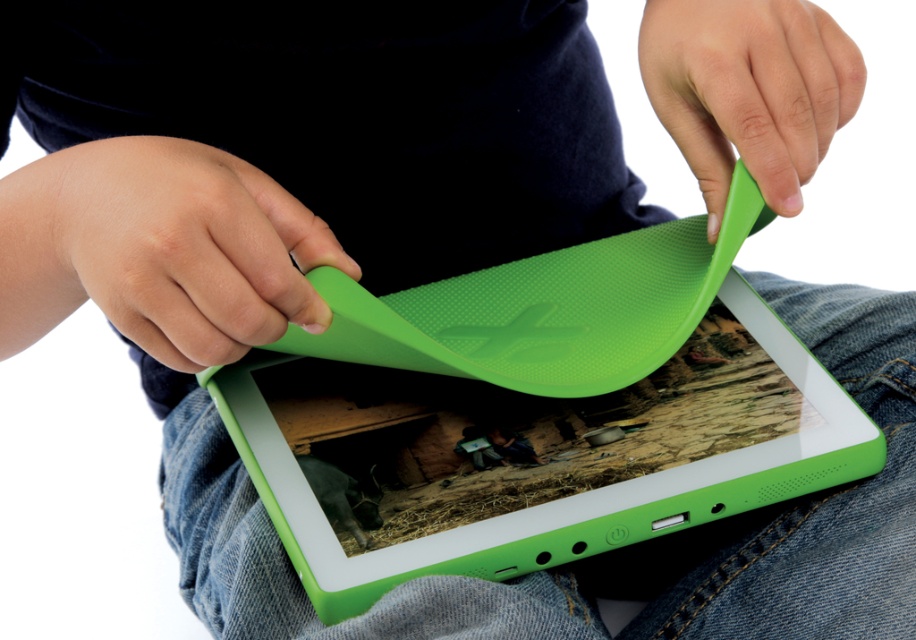
You are a delivery person who needs to place a green rubber tablet at center and a green matte tablet cover at upper left into a box that can only accommodate items within 6 inches of each other. Can you fit both items into the box without exceeding the distance limit?

The distance between the green rubber tablet at center and the green matte tablet cover at upper left is 7.01 inches, which exceeds the 6 inches limit. Therefore, they cannot be placed in the box together without violating the distance requirement.